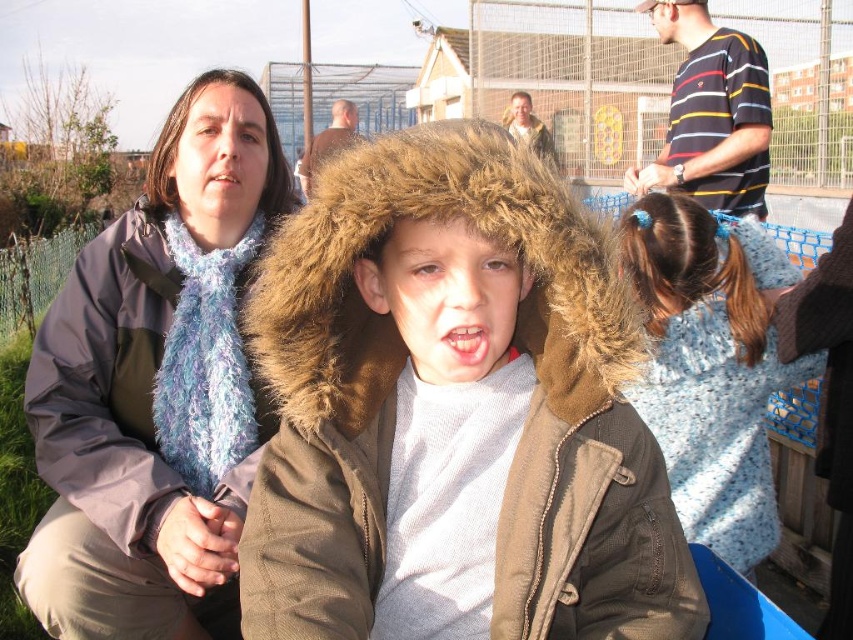
You are organizing a clothing donation drive and need to determine which items can fit into a small donation box. The box can only hold items that take up less space. Which of the two items, the brown corduroy jacket at center or the blue knitted sweater at right, should you choose to place in the box?

The brown corduroy jacket at center occupies less space than the blue knitted sweater at right, so you should choose the brown corduroy jacket at center for the small donation box.